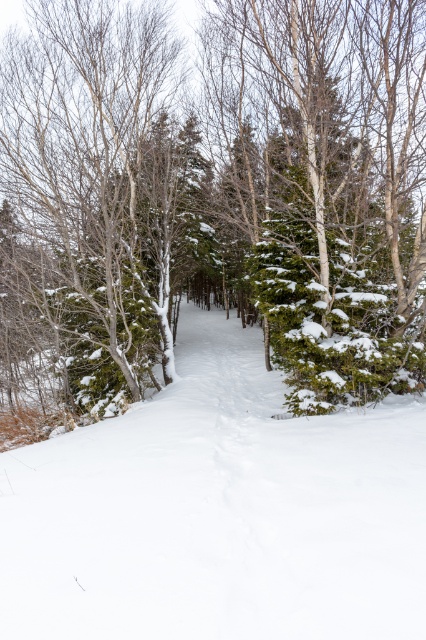
You are planning to build a small cabin on the white snow ski slope at center. The coordinates of the cabin must be within a 0.1 radius of the center point of the ski slope. What are the minimum and maximum x and y coordinates you can choose for the cabin?

The center point of the white snow ski slope at center is at coordinates (218, 513). To stay within a 0.1 radius, the minimum x coordinate is 0.702, the maximum x is 0.902, the minimum y is 0.414, and the maximum y is 0.614.